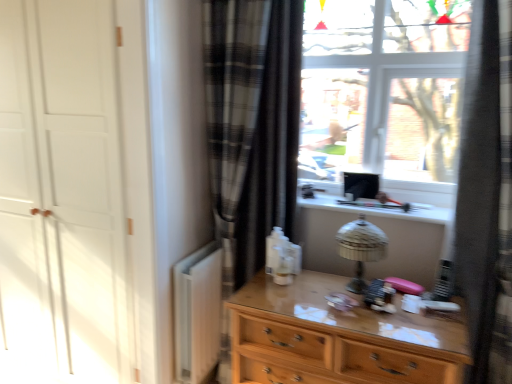
Describe the element at coordinates (479, 183) in the screenshot. I see `black plaid curtain at right` at that location.

This screenshot has width=512, height=384. What do you see at coordinates (361, 248) in the screenshot?
I see `metallic silver table lamp at center` at bounding box center [361, 248].

Where is `plaid fabric curtain at center`? plaid fabric curtain at center is located at coordinates (252, 124).

Measure the distance between point (219, 42) and camera.

The distance of point (219, 42) from camera is 1.96 meters.

This screenshot has height=384, width=512. What do you see at coordinates (62, 190) in the screenshot?
I see `white matte door at left` at bounding box center [62, 190].

Where is `black plaid curtain at right`? The width and height of the screenshot is (512, 384). black plaid curtain at right is located at coordinates (479, 183).

Does plaid fabric curtain at center appear on the right side of white matte door at left?

Indeed, plaid fabric curtain at center is positioned on the right side of white matte door at left.

Considering the positions of objects plaid fabric curtain at center and white matte door at left in the image provided, who is behind, plaid fabric curtain at center or white matte door at left?

plaid fabric curtain at center is more distant.

In the scene shown: From a real-world perspective, is plaid fabric curtain at center on white matte door at left?

No, from a real-world perspective, plaid fabric curtain at center is not on top of white matte door at left.

Is plaid fabric curtain at center smaller than white matte door at left?

Yes, plaid fabric curtain at center is smaller than white matte door at left.

Relative to metallic silver table lamp at center, is black plaid curtain at right in front or behind?

Clearly, black plaid curtain at right is in front of metallic silver table lamp at center.

Looking at this image, which is more to the left, black plaid curtain at right or metallic silver table lamp at center?

metallic silver table lamp at center is more to the left.

From the image's perspective, is black plaid curtain at right on metallic silver table lamp at center?

Yes, from the image's perspective, black plaid curtain at right is above metallic silver table lamp at center.

Is metallic silver table lamp at center at the back of white matte radiator at lower left?

No.

Based on their positions, is white matte radiator at lower left located to the left or right of metallic silver table lamp at center?

Clearly, white matte radiator at lower left is on the left of metallic silver table lamp at center in the image.

From the image's perspective, which one is positioned lower, white matte radiator at lower left or metallic silver table lamp at center?

From the image's view, white matte radiator at lower left is below.

Is white matte radiator at lower left positioned far away from metallic silver table lamp at center?

No, there isn't a large distance between white matte radiator at lower left and metallic silver table lamp at center.

Which of these two, metallic silver table lamp at center or white matte radiator at lower left, is wider?

Wider between the two is metallic silver table lamp at center.

Does metallic silver table lamp at center appear on the right side of white matte radiator at lower left?

Indeed, metallic silver table lamp at center is positioned on the right side of white matte radiator at lower left.

Can you tell me how much metallic silver table lamp at center and white matte radiator at lower left differ in facing direction?

The angle between the facing direction of metallic silver table lamp at center and the facing direction of white matte radiator at lower left is 87.9 degrees.

Where is `radiator below the metallic silver table lamp at center (from a real-world perspective)`? radiator below the metallic silver table lamp at center (from a real-world perspective) is located at coordinates (197, 313).

Is black plaid curtain at right at the left side of white matte radiator at lower left?

Incorrect, black plaid curtain at right is not on the left side of white matte radiator at lower left.

From the picture: Does black plaid curtain at right touch white matte radiator at lower left?

black plaid curtain at right and white matte radiator at lower left are clearly separated.

Considering the relative positions of black plaid curtain at right and white matte radiator at lower left in the image provided, is black plaid curtain at right in front of white matte radiator at lower left?

That is True.

Considering the sizes of objects black plaid curtain at right and white matte radiator at lower left in the image provided, who is wider, black plaid curtain at right or white matte radiator at lower left?

black plaid curtain at right.

This screenshot has width=512, height=384. Identify the location of radiator below the black plaid curtain at right (from the image's perspective). (197, 313).

Is white matte radiator at lower left beside black plaid curtain at right?

No, white matte radiator at lower left is not beside black plaid curtain at right.

Could black plaid curtain at right be considered to be inside white matte radiator at lower left?

Definitely not — black plaid curtain at right is not inside white matte radiator at lower left.

Which object is positioned more to the left, white matte radiator at lower left or black plaid curtain at right?

From the viewer's perspective, white matte radiator at lower left appears more on the left side.

Is plaid fabric curtain at center oriented away from white matte radiator at lower left?

No, white matte radiator at lower left is not at the back of plaid fabric curtain at center.

Which point is more distant from viewer, (x=247, y=191) or (x=205, y=297)?

The point (x=247, y=191) is more distant.

Is plaid fabric curtain at center taller than white matte radiator at lower left?

Yes.

This screenshot has width=512, height=384. In order to click on curtain beneath the white matte door at left (from a real-world perspective) in this screenshot , I will do `click(252, 124)`.

Where is `table lamp located on the left of black plaid curtain at right`? The height and width of the screenshot is (384, 512). table lamp located on the left of black plaid curtain at right is located at coordinates (361, 248).

Considering their positions, is wooden chest of drawers at center positioned further to white matte door at left than white matte radiator at lower left?

The object further to white matte door at left is wooden chest of drawers at center.

Based on their spatial positions, is white matte door at left or black plaid curtain at right closer to white matte radiator at lower left?

Based on the image, white matte door at left appears to be nearer to white matte radiator at lower left.

Estimate the real-world distances between objects in this image. Which object is closer to black plaid curtain at right, white matte door at left or white matte radiator at lower left?

The object closer to black plaid curtain at right is white matte radiator at lower left.

Based on their spatial positions, is wooden chest of drawers at center or plaid fabric curtain at center further from white matte radiator at lower left?

Based on the image, wooden chest of drawers at center appears to be further to white matte radiator at lower left.

Looking at the image, which one is located closer to white matte radiator at lower left, black plaid curtain at right or metallic silver table lamp at center?

metallic silver table lamp at center lies closer to white matte radiator at lower left than the other object.

Considering their positions, is white matte radiator at lower left positioned further to black plaid curtain at right than metallic silver table lamp at center?

white matte radiator at lower left.

When comparing their distances from plaid fabric curtain at center, does metallic silver table lamp at center or wooden chest of drawers at center seem closer?

Based on the image, metallic silver table lamp at center appears to be nearer to plaid fabric curtain at center.

Looking at the image, which one is located further to wooden chest of drawers at center, white matte door at left or plaid fabric curtain at center?

white matte door at left lies further to wooden chest of drawers at center than the other object.

The width and height of the screenshot is (512, 384). What are the coordinates of `radiator situated between white matte door at left and wooden chest of drawers at center from left to right` in the screenshot? It's located at (197, 313).

At what (x,y) coordinates should I click in order to perform the action: click on the chest of drawers situated between white matte radiator at lower left and metallic silver table lamp at center from left to right. Please return your answer as a coordinate pair (x, y). Looking at the image, I should click on (336, 338).

At what (x,y) coordinates should I click in order to perform the action: click on radiator located between white matte door at left and metallic silver table lamp at center in the left-right direction. Please return your answer as a coordinate pair (x, y). The height and width of the screenshot is (384, 512). Looking at the image, I should click on (197, 313).

Image resolution: width=512 pixels, height=384 pixels. What are the coordinates of `curtain between white matte door at left and metallic silver table lamp at center from left to right` in the screenshot? It's located at (252, 124).